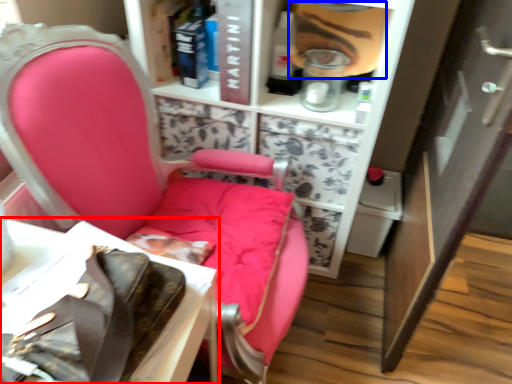
Question: Which point is closer to the camera, table (highlighted by a red box) or person (highlighted by a blue box)?

Choices:
 (A) table
 (B) person

Answer: (A)